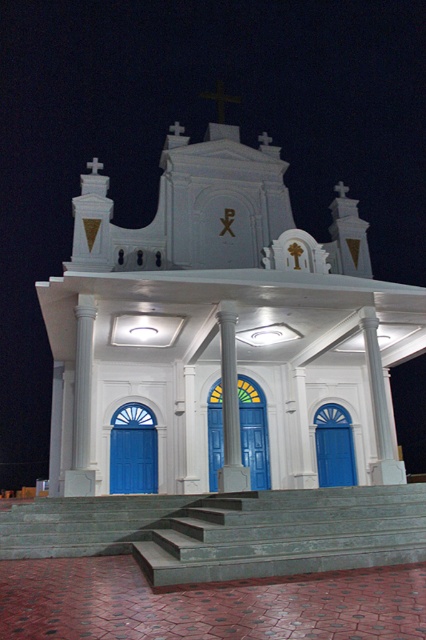
You are standing at the base of the smooth concrete stairs at center, looking up towards the blue matte door at center. Which object is shorter in height?

The smooth concrete stairs at center is not as tall as the blue matte door at center, so the smooth concrete stairs at center is shorter in height.

Looking at this image, you are a delivery person carrying a 5 meter long ladder. You need to place it between the smooth concrete stairs at center and the white smooth column at center. Is there enough space for the ladder to fit horizontally between them?

The smooth concrete stairs at center and white smooth column at center are 5.23 meters apart from each other. Since the ladder is 5 meters long, there is enough space for the ladder to fit horizontally between them as the distance between them is greater than the ladder length.

You are standing in front of the white glossy church at center and want to enter through the blue painted wood door at center. Which direction should you walk to reach the door?

Since the white glossy church at center is in front of the blue painted wood door at center, you should walk backward to reach the door.